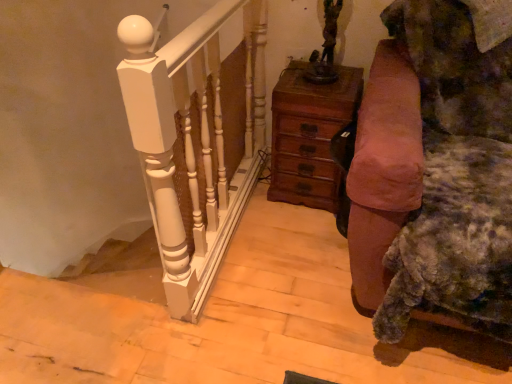
Find the location of `unoccupied area in front of wooden chest of drawers at center`. unoccupied area in front of wooden chest of drawers at center is located at coordinates (297, 230).